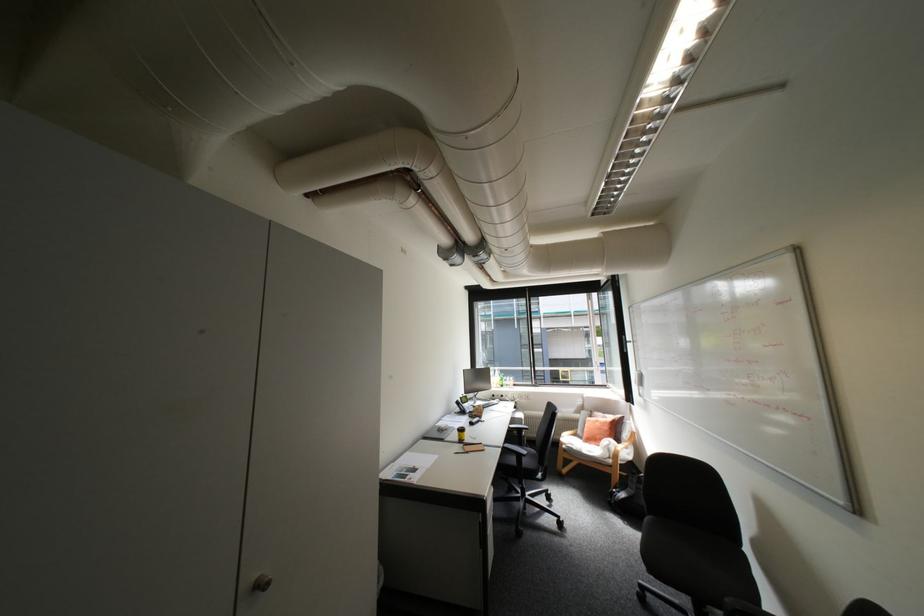
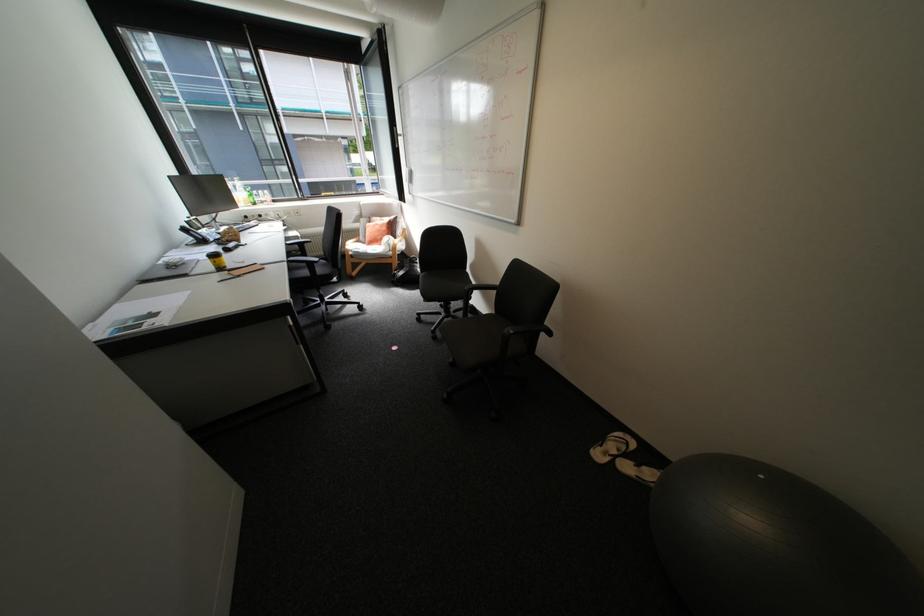
Where in the second image is the point corresponding to (467,403) from the first image?

(195, 230)